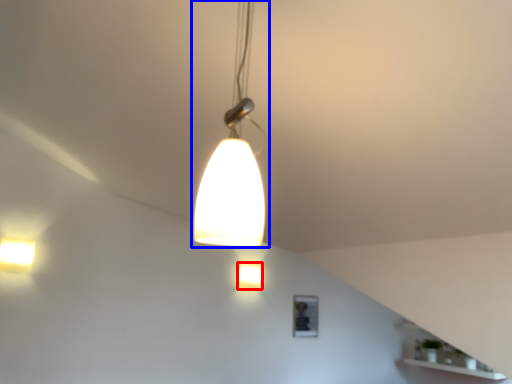
Question: Which object appears closest to the camera in this image, lamp (highlighted by a red box) or lamp (highlighted by a blue box)?

Choices:
 (A) lamp
 (B) lamp

Answer: (B)